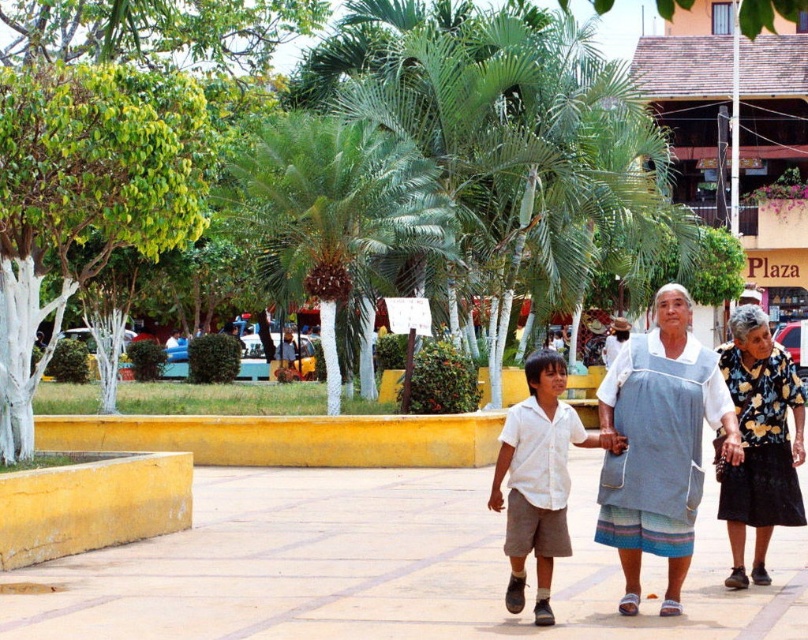
Can you confirm if smooth concrete pavement at center is smaller than white cotton shirt at center?

Indeed, smooth concrete pavement at center has a smaller size compared to white cotton shirt at center.

Which is above, smooth concrete pavement at center or white cotton shirt at center?

Positioned higher is white cotton shirt at center.

Who is more forward, (365,563) or (522,515)?

Point (522,515) is in front.

The width and height of the screenshot is (808, 640). I want to click on smooth concrete pavement at center, so click(x=383, y=568).

Which is behind, point (308, 193) or point (745, 502)?

The point (308, 193) is more distant.

Where is `green leafy palm tree at center`? green leafy palm tree at center is located at coordinates (329, 211).

Can you confirm if green leafy palm tree at center is taller than white cotton shirt at center?

Yes.

Find the location of a particular element. This screenshot has height=640, width=808. green leafy palm tree at center is located at coordinates (329, 211).

In order to click on green leafy palm tree at center in this screenshot , I will do `click(329, 211)`.